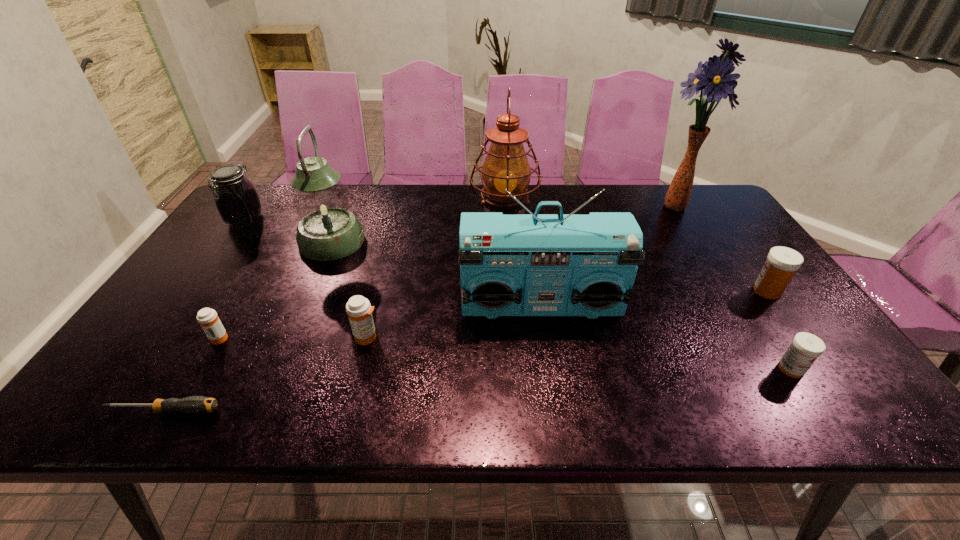
Image resolution: width=960 pixels, height=540 pixels. What are the coordinates of `the left orange medicine` in the screenshot? It's located at (207, 318).

At what (x,y) coordinates should I click in order to perform the action: click on the leftmost medicine. Please return your answer as a coordinate pair (x, y). Looking at the image, I should click on (207, 318).

I want to click on the nearest medicine, so click(805, 348).

Find the location of a particular element. the smaller white medicine is located at coordinates (805, 348).

Locate an element on the screen. This screenshot has height=540, width=960. the nearest object is located at coordinates (194, 404).

I want to click on the shortest object, so click(x=194, y=404).

Locate an element on the screen. blank space located on the left of the flower arrangement is located at coordinates (533, 205).

The height and width of the screenshot is (540, 960). What are the coordinates of `free space located on the front of the oil lamp` in the screenshot? It's located at (513, 319).

Where is `vacant region located 0.260m on the front of the greenish lantern`? The height and width of the screenshot is (540, 960). vacant region located 0.260m on the front of the greenish lantern is located at coordinates (295, 329).

Find the location of a particular element. vacant space located on the front-facing side of the radio receiver is located at coordinates (552, 385).